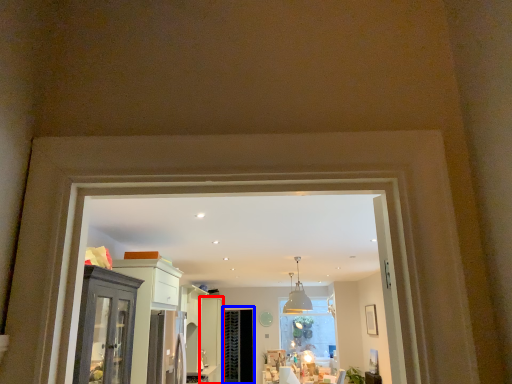
Question: Which point is closer to the camera, door (highlighted by a red box) or screen door (highlighted by a blue box)?

Choices:
 (A) door
 (B) screen door

Answer: (A)